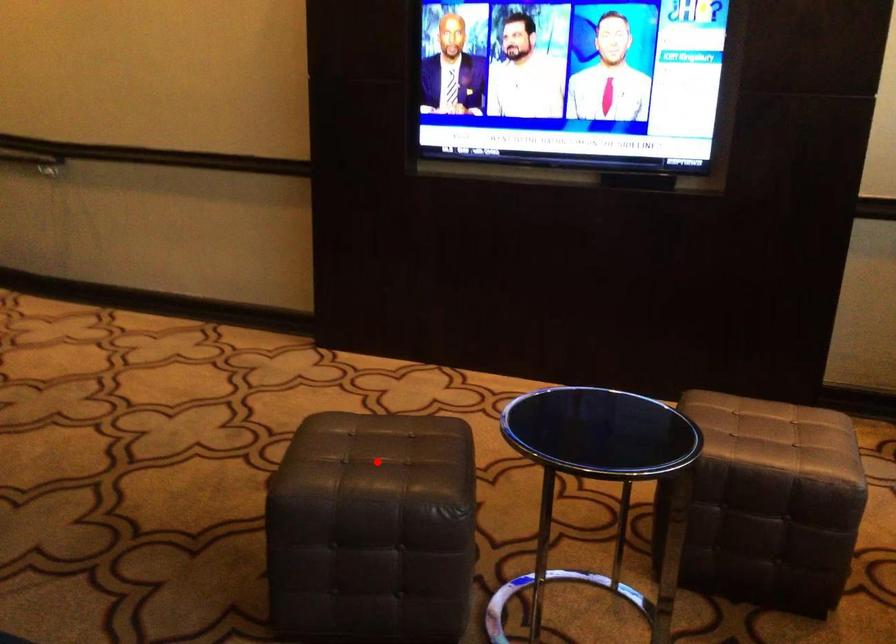
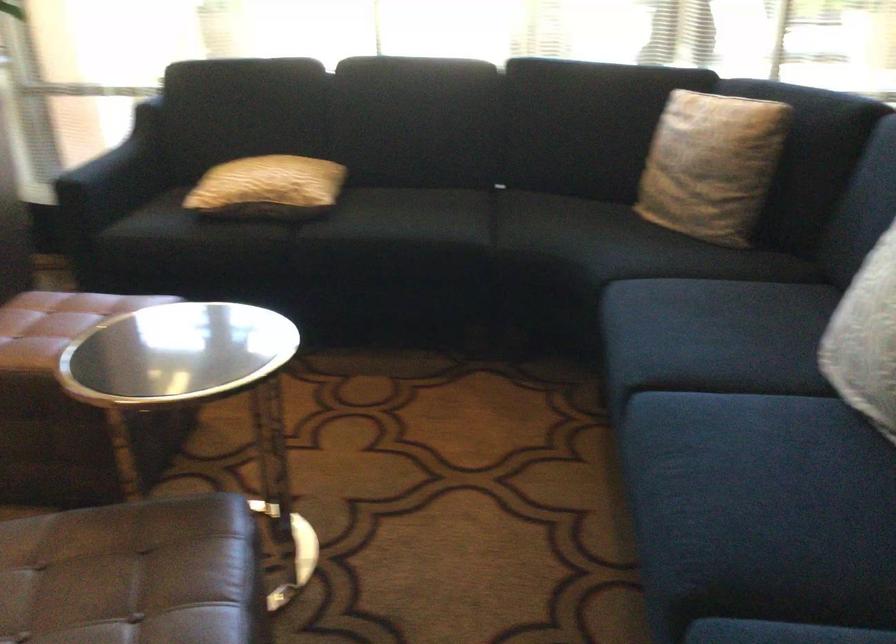
Question: I am providing you with two images of the same scene from different viewpoints. Given a red point in image1, look at the same physical point in image2. Is it:

Choices:
 (A) Closer to the viewpoint
 (B) Farther from the viewpoint

Answer: (A)